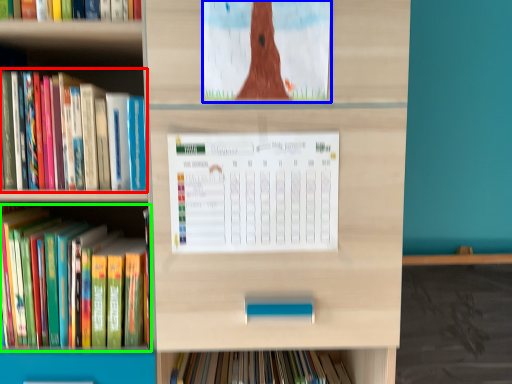
Question: Which is nearer to the book (highlighted by a red box)? book cover (highlighted by a blue box) or book (highlighted by a green box).

Choices:
 (A) book cover
 (B) book

Answer: (B)